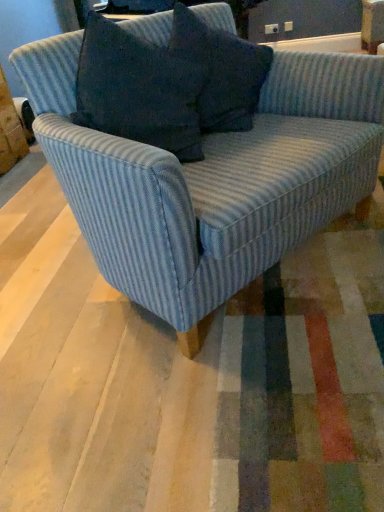
You are a GUI agent. You are given a task and a screenshot of the screen. Output one action in this format:
    pyautogui.click(x=<x>, y=<y>)
    Task: Click on the blue striped fabric couch at center
    The height and width of the screenshot is (512, 384).
    Given the screenshot: What is the action you would take?
    pyautogui.click(x=211, y=178)

Describe the element at coordinates (211, 178) in the screenshot. I see `blue striped fabric couch at center` at that location.

This screenshot has width=384, height=512. Find the location of `blue textured pillow at upper center`. blue textured pillow at upper center is located at coordinates (221, 71).

The image size is (384, 512). What do you see at coordinates (221, 71) in the screenshot? I see `blue textured pillow at upper center` at bounding box center [221, 71].

You are a GUI agent. You are given a task and a screenshot of the screen. Output one action in this format:
    pyautogui.click(x=<x>, y=<y>)
    Task: Click on the blue striped fabric couch at center
    The width and height of the screenshot is (384, 512).
    Given the screenshot: What is the action you would take?
    pyautogui.click(x=211, y=178)

Which object is positioned more to the right, blue striped fabric couch at center or blue textured pillow at upper center?

From the viewer's perspective, blue textured pillow at upper center appears more on the right side.

Is blue striped fabric couch at center positioned in front of blue textured pillow at upper center?

Yes, it is.

Does point (285, 167) come closer to viewer compared to point (217, 33)?

Yes, point (285, 167) is closer to viewer.

From the image's perspective, is blue striped fabric couch at center above or below blue textured pillow at upper center?

blue striped fabric couch at center is below blue textured pillow at upper center.

From a real-world perspective, between blue striped fabric couch at center and blue textured pillow at upper center, who is vertically lower?

In real-world perspective, blue striped fabric couch at center is lower.

In terms of width, does blue striped fabric couch at center look wider or thinner when compared to blue textured pillow at upper center?

In the image, blue striped fabric couch at center appears to be wider than blue textured pillow at upper center.

Considering the relative sizes of blue striped fabric couch at center and blue textured pillow at upper center in the image provided, is blue striped fabric couch at center taller than blue textured pillow at upper center?

Indeed, blue striped fabric couch at center has a greater height compared to blue textured pillow at upper center.

Considering the sizes of objects blue striped fabric couch at center and blue textured pillow at upper center in the image provided, who is bigger, blue striped fabric couch at center or blue textured pillow at upper center?

blue striped fabric couch at center is bigger.

Is blue striped fabric couch at center not within blue textured pillow at upper center?

blue striped fabric couch at center lies outside blue textured pillow at upper center's area.

Is blue striped fabric couch at center not close to blue textured pillow at upper center?

Actually, blue striped fabric couch at center and blue textured pillow at upper center are a little close together.

Does blue striped fabric couch at center turn towards blue textured pillow at upper center?

Yes, blue striped fabric couch at center is turned towards blue textured pillow at upper center.

Identify the location of pillow above the blue striped fabric couch at center (from a real-world perspective). (221, 71).

Can you confirm if blue textured pillow at upper center is positioned to the left of blue striped fabric couch at center?

Incorrect, blue textured pillow at upper center is not on the left side of blue striped fabric couch at center.

Considering the positions of objects blue textured pillow at upper center and blue striped fabric couch at center in the image provided, who is behind, blue textured pillow at upper center or blue striped fabric couch at center?

blue textured pillow at upper center is further away from the camera.

Between point (238, 45) and point (56, 164), which one is positioned behind?

Positioned behind is point (238, 45).

From the image's perspective, is blue textured pillow at upper center over blue striped fabric couch at center?

Correct, blue textured pillow at upper center appears higher than blue striped fabric couch at center in the image.

From a real-world perspective, which is physically above, blue textured pillow at upper center or blue striped fabric couch at center?

blue textured pillow at upper center, from a real-world perspective.

Which object is wider, blue textured pillow at upper center or blue striped fabric couch at center?

With larger width is blue striped fabric couch at center.

Does blue textured pillow at upper center have a greater height compared to blue striped fabric couch at center?

No.

Considering the sizes of objects blue textured pillow at upper center and blue striped fabric couch at center in the image provided, who is bigger, blue textured pillow at upper center or blue striped fabric couch at center?

blue striped fabric couch at center is bigger.

Would you say blue textured pillow at upper center contains blue striped fabric couch at center?

Definitely not — blue striped fabric couch at center is not inside blue textured pillow at upper center.

Is blue textured pillow at upper center touching blue striped fabric couch at center?

blue textured pillow at upper center is not next to blue striped fabric couch at center, and they're not touching.

Could you tell me if blue textured pillow at upper center is turned towards blue striped fabric couch at center?

Yes, blue textured pillow at upper center is turned towards blue striped fabric couch at center.

From the picture: What's the angular difference between blue textured pillow at upper center and blue striped fabric couch at center's facing directions?

3.22 degrees.

Where is `studio couch on the left side of blue textured pillow at upper center`? The image size is (384, 512). studio couch on the left side of blue textured pillow at upper center is located at coordinates (211, 178).

This screenshot has width=384, height=512. What are the coordinates of `studio couch below the blue textured pillow at upper center (from the image's perspective)` in the screenshot? It's located at (211, 178).

Find the location of a particular element. Image resolution: width=384 pixels, height=512 pixels. pillow that appears above the blue striped fabric couch at center (from a real-world perspective) is located at coordinates (221, 71).